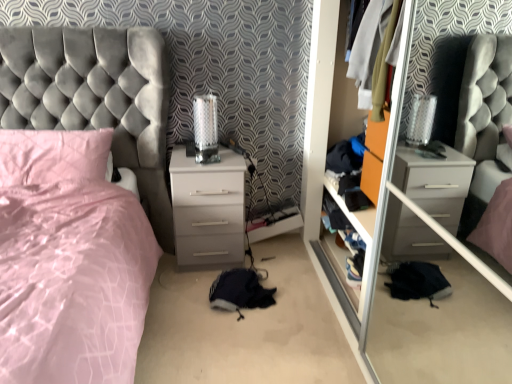
Question: Is point (231, 220) positioned closer to the camera than point (109, 243)?

Choices:
 (A) closer
 (B) farther

Answer: (B)

Question: From the image's perspective, is white glossy chest of drawers at center located above or below velvet grey bed at left?

Choices:
 (A) above
 (B) below

Answer: (A)

Question: Which object is positioned farthest from the transparent glass door at center?

Choices:
 (A) velvet grey bed at left
 (B) satin pink pillow at left
 (C) white glossy chest of drawers at center
 (D) wooden shelf at center

Answer: (B)

Question: Which of these objects is positioned closest to the velvet grey bed at left?

Choices:
 (A) white glossy chest of drawers at center
 (B) satin pink pillow at left
 (C) transparent glass door at center
 (D) wooden shelf at center

Answer: (B)